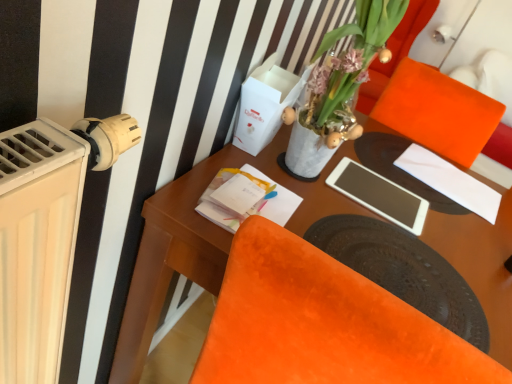
This screenshot has height=384, width=512. Find the location of `vacant area to the right of white matte tablet at center`. vacant area to the right of white matte tablet at center is located at coordinates (457, 238).